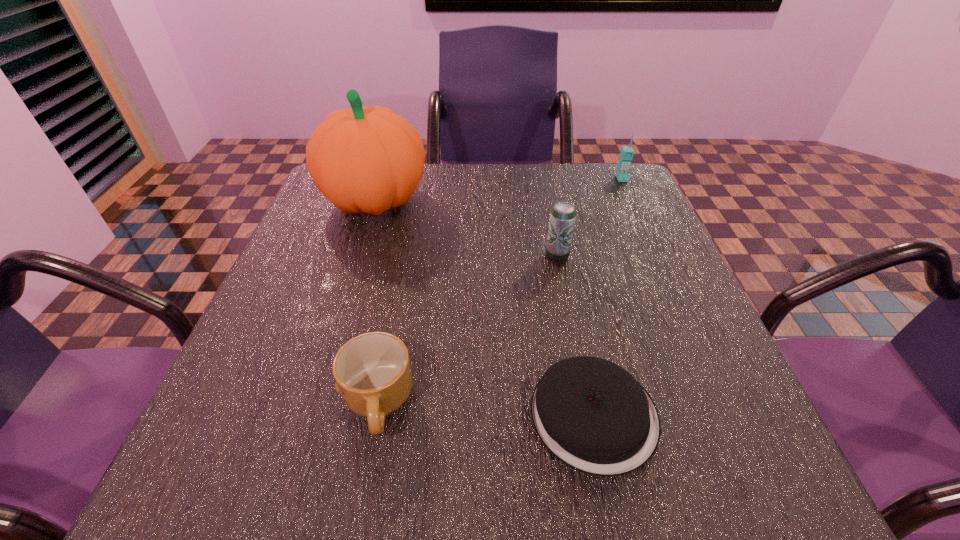
The width and height of the screenshot is (960, 540). Identify the location of cellular telephone that is at the far edge. (622, 174).

Where is `mug present at the near edge`? mug present at the near edge is located at coordinates (372, 371).

Locate an element on the screen. The width and height of the screenshot is (960, 540). pancake situated at the near edge is located at coordinates (594, 416).

Where is `object situated at the left edge`? object situated at the left edge is located at coordinates (369, 160).

You are a GUI agent. You are given a task and a screenshot of the screen. Output one action in this format:
    pyautogui.click(x=<x>, y=<y>)
    Task: Click on the cellular telephone situated at the right edge
    The height and width of the screenshot is (540, 960).
    Given the screenshot: What is the action you would take?
    pyautogui.click(x=622, y=174)

Where is `pancake located at the right edge`? This screenshot has width=960, height=540. pancake located at the right edge is located at coordinates (594, 416).

Find the location of `object that is at the far left corner`. object that is at the far left corner is located at coordinates (369, 160).

Find the location of a particular element. Image resolution: width=960 pixels, height=540 pixels. object situated at the far right corner is located at coordinates (622, 174).

Find the location of `object that is at the near right corner`. object that is at the near right corner is located at coordinates (594, 416).

This screenshot has height=540, width=960. I want to click on vacant region at the far edge of the desktop, so click(x=419, y=206).